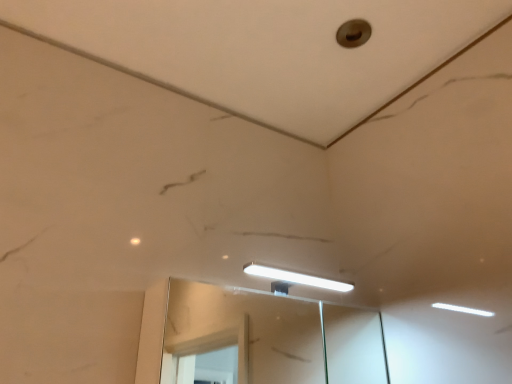
Question: From a real-world perspective, is clear glass mirror at center positioned above or below metallic circular hole at upper center?

Choices:
 (A) above
 (B) below

Answer: (B)

Question: Considering the positions of clear glass mirror at center and metallic circular hole at upper center in the image, is clear glass mirror at center bigger or smaller than metallic circular hole at upper center?

Choices:
 (A) small
 (B) big

Answer: (B)

Question: From their relative heights in the image, would you say clear glass mirror at center is taller or shorter than metallic circular hole at upper center?

Choices:
 (A) short
 (B) tall

Answer: (B)

Question: In terms of height, does metallic circular hole at upper center look taller or shorter compared to clear glass mirror at center?

Choices:
 (A) tall
 (B) short

Answer: (B)

Question: From the image's perspective, relative to clear glass mirror at center, is metallic circular hole at upper center above or below?

Choices:
 (A) above
 (B) below

Answer: (A)

Question: Based on their sizes in the image, would you say metallic circular hole at upper center is bigger or smaller than clear glass mirror at center?

Choices:
 (A) small
 (B) big

Answer: (A)

Question: Is metallic circular hole at upper center situated inside clear glass mirror at center or outside?

Choices:
 (A) outside
 (B) inside

Answer: (A)